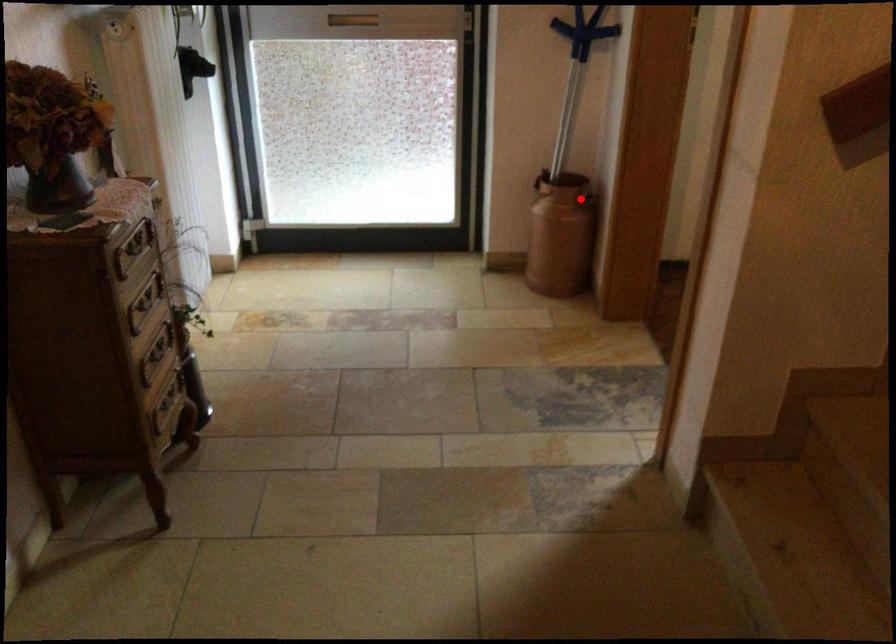
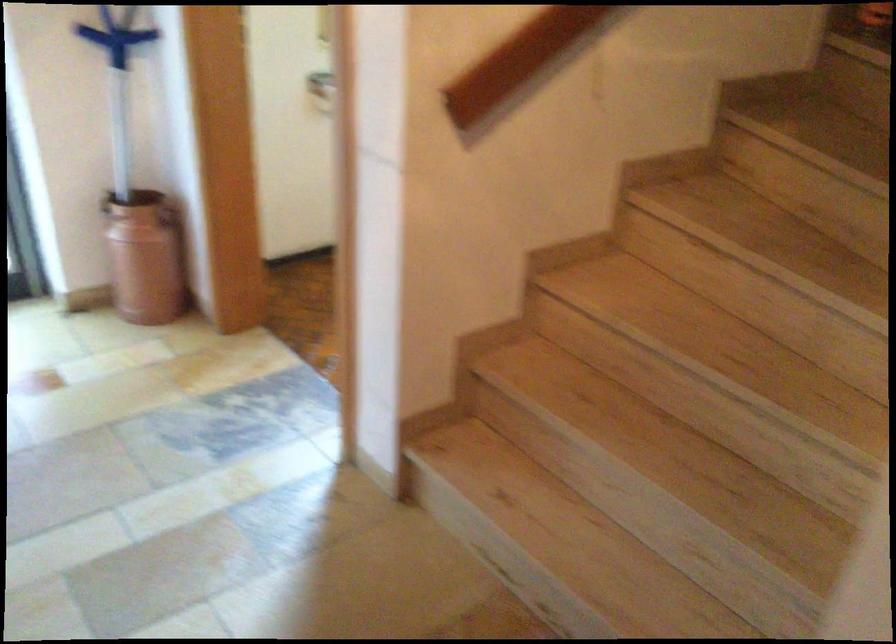
Find the pixel in the second image that matches the highlighted location in the first image.

(168, 216)